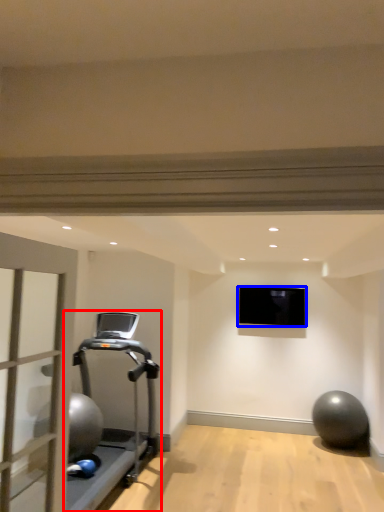
Question: Which object appears farthest to the camera in this image, treadmill (highlighted by a red box) or projection screen (highlighted by a blue box)?

Choices:
 (A) treadmill
 (B) projection screen

Answer: (B)